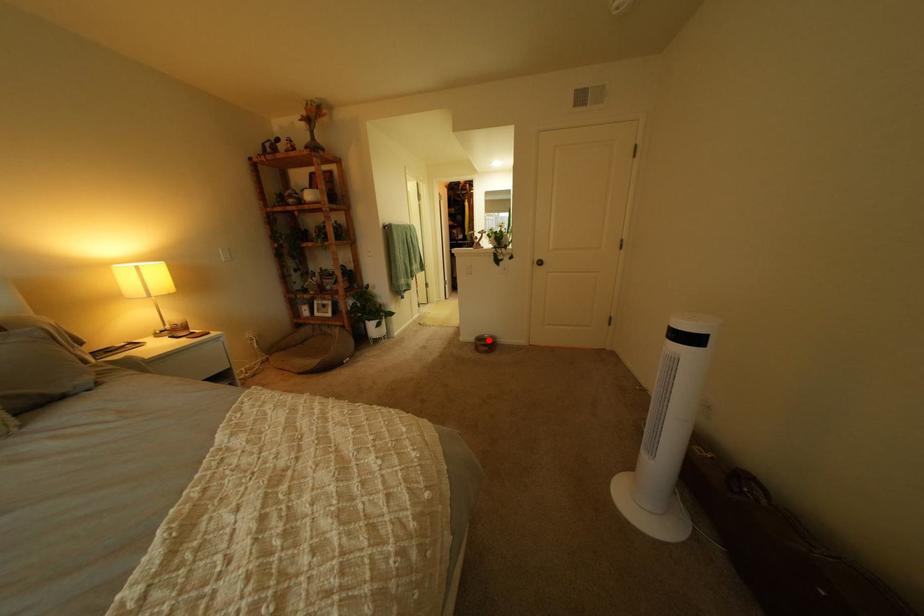
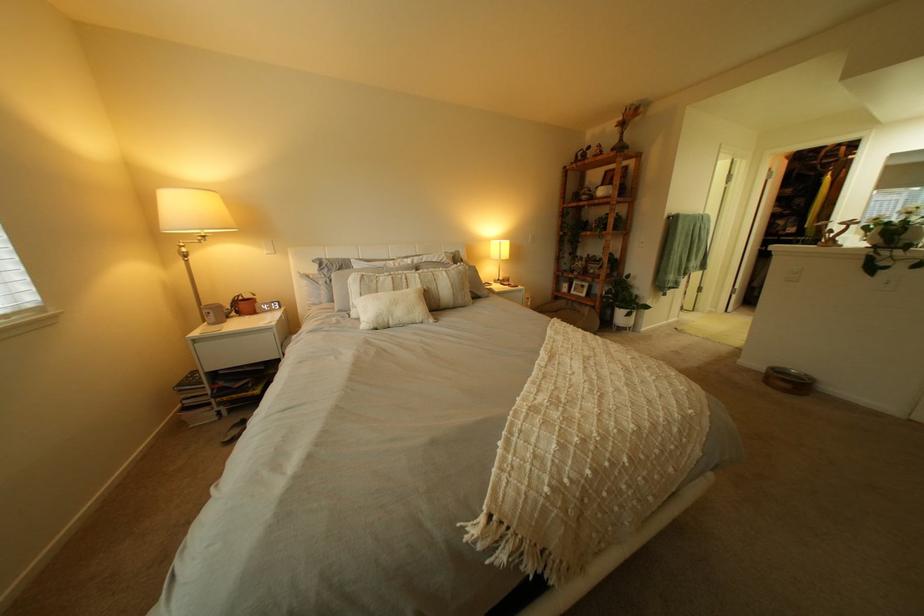
The point at the highlighted location is marked in the first image. Where is the corresponding point in the second image?

(779, 369)